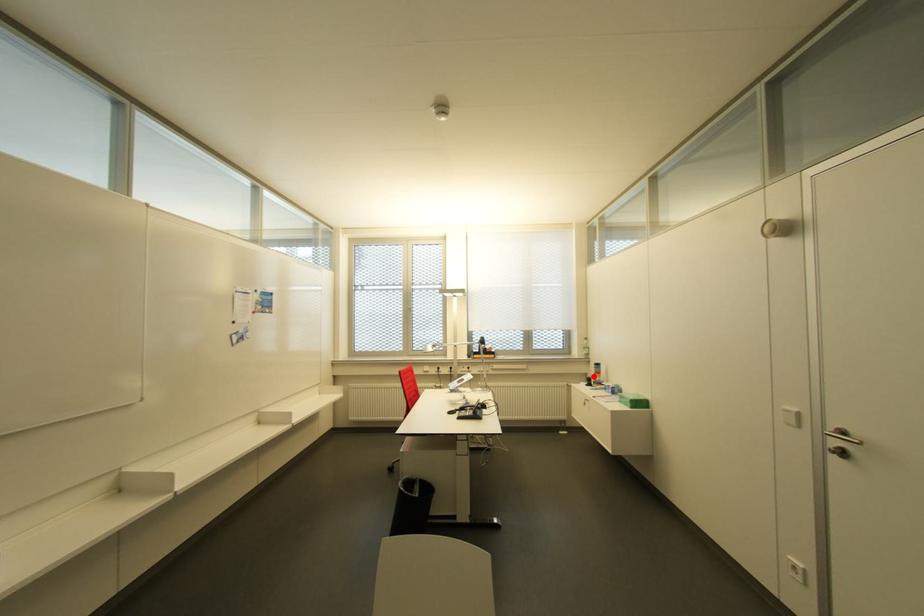
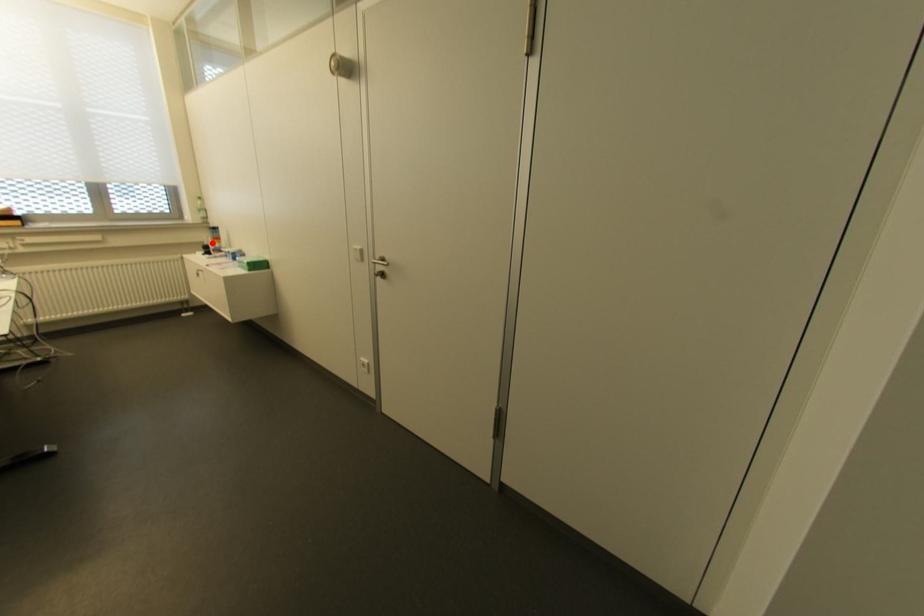
I am providing you with two images of the same scene from different viewpoints. A red point is marked on the first image and another point is marked on the second image. Do the highlighted points in image1 and image2 indicate the same real-world spot?

Yes